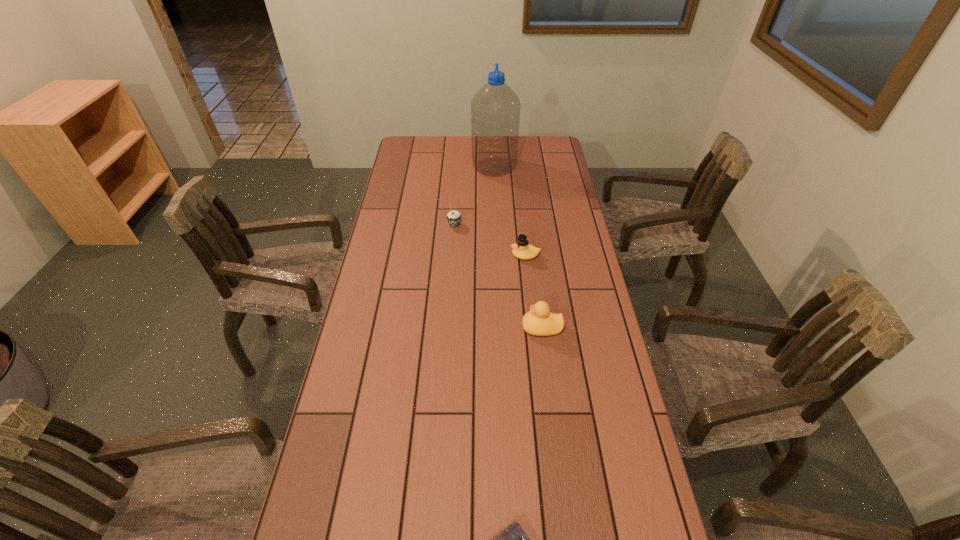
Locate an element on the screen. This screenshot has width=960, height=540. the farthest object is located at coordinates (495, 109).

Locate an element on the screen. This screenshot has width=960, height=540. the tallest object is located at coordinates (495, 109).

The image size is (960, 540). What are the coordinates of `the taller duck` in the screenshot? It's located at (539, 321).

Image resolution: width=960 pixels, height=540 pixels. What are the coordinates of `the second nearest object` in the screenshot? It's located at (539, 321).

The width and height of the screenshot is (960, 540). In order to click on the shorter duck in this screenshot , I will do `click(522, 249)`.

Where is `the farther duck`? The width and height of the screenshot is (960, 540). the farther duck is located at coordinates (522, 249).

At what (x,y) coordinates should I click in order to perform the action: click on cupcake. Please return your answer as a coordinate pair (x, y). This screenshot has height=540, width=960. Looking at the image, I should click on (453, 217).

Where is `free space located on the left of the water jug`? Image resolution: width=960 pixels, height=540 pixels. free space located on the left of the water jug is located at coordinates (405, 167).

Where is `vacant space situated 0.400m on the face of the second tallest object`? vacant space situated 0.400m on the face of the second tallest object is located at coordinates (385, 328).

I want to click on vacant space located 0.210m on the face of the second tallest object, so click(x=450, y=328).